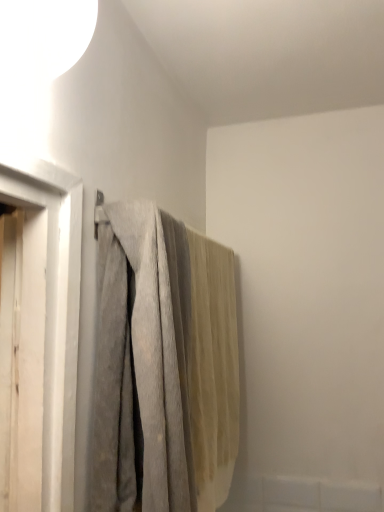
Locate an element on the screen. The image size is (384, 512). white matte lampshade at upper left is located at coordinates (37, 57).

In order to face white matte lampshade at upper left, should I rotate leftwards or rightwards?

To face it directly, rotate left by 25.273 degrees.

What do you see at coordinates (37, 57) in the screenshot? The width and height of the screenshot is (384, 512). I see `white matte lampshade at upper left` at bounding box center [37, 57].

I want to click on gray textured fabric at center, so click(164, 365).

Image resolution: width=384 pixels, height=512 pixels. What do you see at coordinates (164, 365) in the screenshot?
I see `gray textured fabric at center` at bounding box center [164, 365].

This screenshot has width=384, height=512. Identify the location of white matte lampshade at upper left. (37, 57).

Can you confirm if gray textured fabric at center is positioned to the left of white matte lampshade at upper left?

In fact, gray textured fabric at center is to the right of white matte lampshade at upper left.

Who is more distant, gray textured fabric at center or white matte lampshade at upper left?

gray textured fabric at center is more distant.

Which is behind, point (180, 496) or point (56, 31)?

The point (180, 496) is farther from the camera.

From the image's perspective, is gray textured fabric at center beneath white matte lampshade at upper left?

Yes.

From a real-world perspective, is gray textured fabric at center over white matte lampshade at upper left?

No, from a real-world perspective, gray textured fabric at center is not above white matte lampshade at upper left.

Considering the sizes of objects gray textured fabric at center and white matte lampshade at upper left in the image provided, who is wider, gray textured fabric at center or white matte lampshade at upper left?

gray textured fabric at center.

Can you confirm if gray textured fabric at center is shorter than white matte lampshade at upper left?

Incorrect, the height of gray textured fabric at center does not fall short of that of white matte lampshade at upper left.

Does gray textured fabric at center have a smaller size compared to white matte lampshade at upper left?

No, gray textured fabric at center is not smaller than white matte lampshade at upper left.

In the scene shown: Is gray textured fabric at center positioned beyond the bounds of white matte lampshade at upper left?

Indeed, gray textured fabric at center is completely outside white matte lampshade at upper left.

Is gray textured fabric at center not near white matte lampshade at upper left?

No.

In the scene shown: Is gray textured fabric at center facing away from white matte lampshade at upper left?

No, gray textured fabric at center is not facing away from white matte lampshade at upper left.

In the scene shown: Can you tell me how much gray textured fabric at center and white matte lampshade at upper left differ in facing direction?

They differ by 8.07 degrees in their facing directions.

You are a GUI agent. You are given a task and a screenshot of the screen. Output one action in this format:
    pyautogui.click(x=<x>, y=<y>)
    Task: Click on the curtain that is behind the white matte lampshade at upper left
    The width and height of the screenshot is (384, 512).
    Given the screenshot: What is the action you would take?
    pyautogui.click(x=164, y=365)

Based on the photo, which object is positioned more to the right, white matte lampshade at upper left or gray textured fabric at center?

From the viewer's perspective, gray textured fabric at center appears more on the right side.

Between white matte lampshade at upper left and gray textured fabric at center, which one is positioned behind?

gray textured fabric at center is further away from the camera.

Is point (22, 71) farther from camera compared to point (150, 426)?

That is False.

From the image's perspective, which is above, white matte lampshade at upper left or gray textured fabric at center?

white matte lampshade at upper left.

From a real-world perspective, is white matte lampshade at upper left above or below gray textured fabric at center?

white matte lampshade at upper left is situated higher than gray textured fabric at center in the real world.

Consider the image. Which object is wider, white matte lampshade at upper left or gray textured fabric at center?

gray textured fabric at center is wider.

Considering the relative sizes of white matte lampshade at upper left and gray textured fabric at center in the image provided, is white matte lampshade at upper left taller than gray textured fabric at center?

Incorrect, the height of white matte lampshade at upper left is not larger of that of gray textured fabric at center.

Considering the relative sizes of white matte lampshade at upper left and gray textured fabric at center in the image provided, is white matte lampshade at upper left smaller than gray textured fabric at center?

Yes.

Is white matte lampshade at upper left located outside gray textured fabric at center?

Yes, white matte lampshade at upper left is not within gray textured fabric at center.

Is white matte lampshade at upper left next to gray textured fabric at center?

There is a gap between white matte lampshade at upper left and gray textured fabric at center.

Is white matte lampshade at upper left oriented away from gray textured fabric at center?

No, white matte lampshade at upper left's orientation is not away from gray textured fabric at center.

This screenshot has height=512, width=384. I want to click on lamp that appears above the gray textured fabric at center (from a real-world perspective), so click(37, 57).

Locate an element on the screen. curtain below the white matte lampshade at upper left (from the image's perspective) is located at coordinates (164, 365).

Where is `lamp that is above the gray textured fabric at center (from a real-world perspective)`? This screenshot has width=384, height=512. lamp that is above the gray textured fabric at center (from a real-world perspective) is located at coordinates (37, 57).